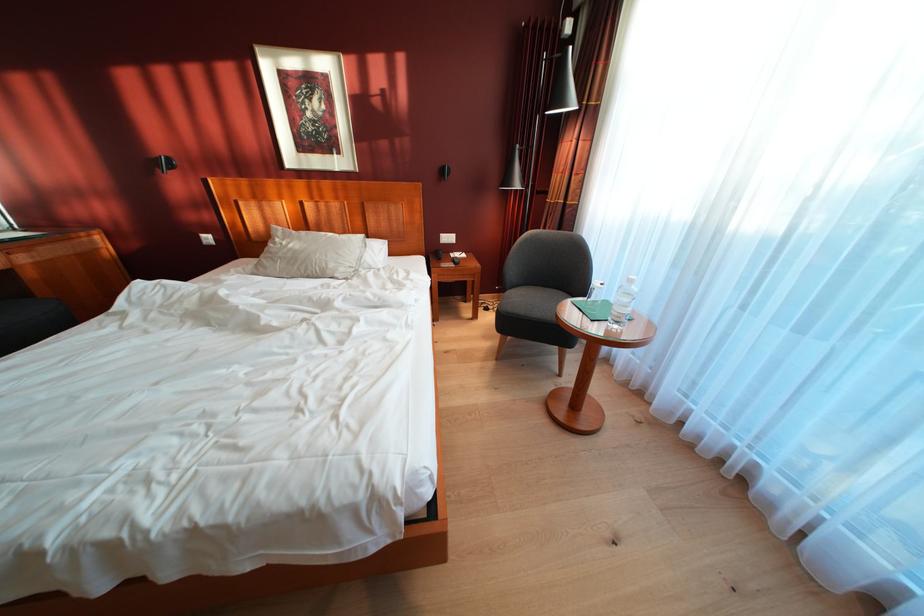
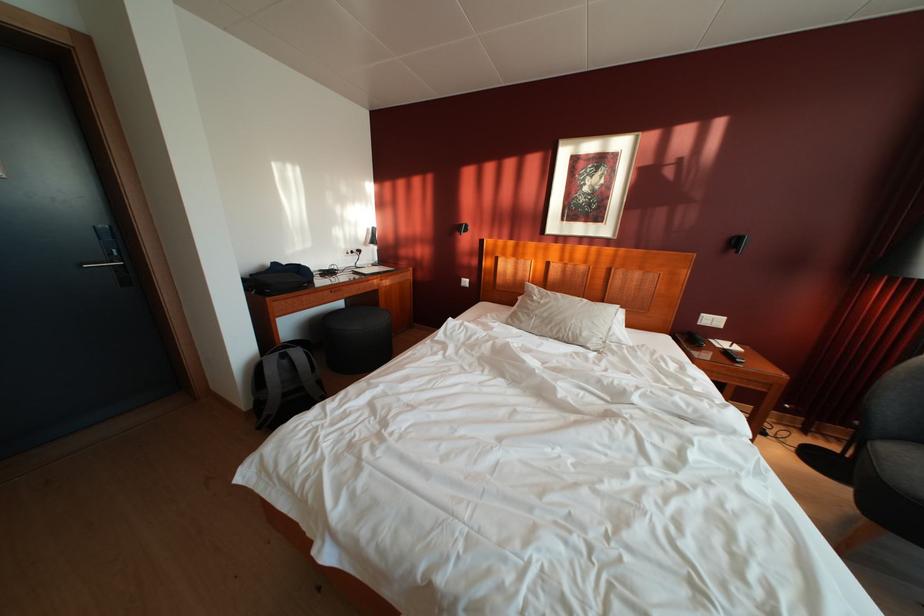
Where in the second image is the point corresponding to [339,272] from the first image?

(593, 339)